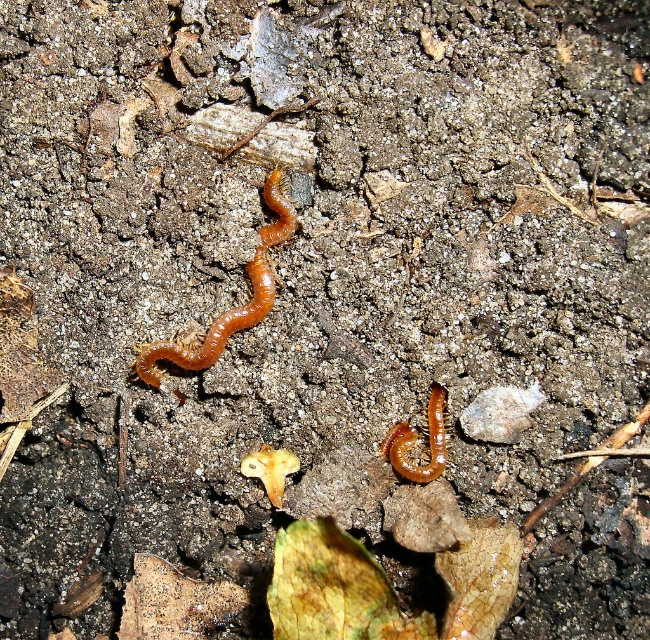
You are a gardener trying to identify which centipede is closer to the left edge of the soil patch. You see the shiny orange centipede at center and the orange rubbery centipede at lower center. Which one is positioned more to the left?

The shiny orange centipede at center is positioned more to the left than the orange rubbery centipede at lower center.

Based on the photo, you are a scientist observing two centipedes in a soil sample. You notice the shiny orange centipede at center and the orange rubbery centipede at lower center. Which of these has a larger height?

The shiny orange centipede at center has a greater height compared to the orange rubbery centipede at lower center.